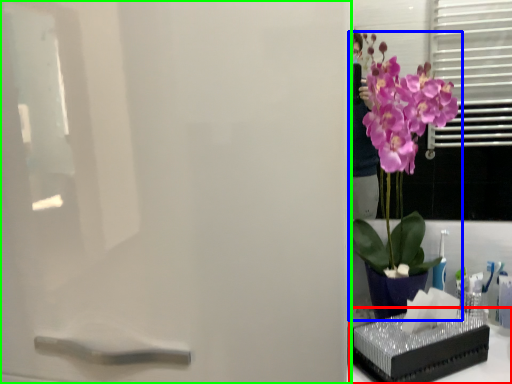
Question: Estimate the real-world distances between objects in this image. Which object is farther from window sill (highlighted by a red box), houseplant (highlighted by a blue box) or screen door (highlighted by a green box)?

Choices:
 (A) houseplant
 (B) screen door

Answer: (B)